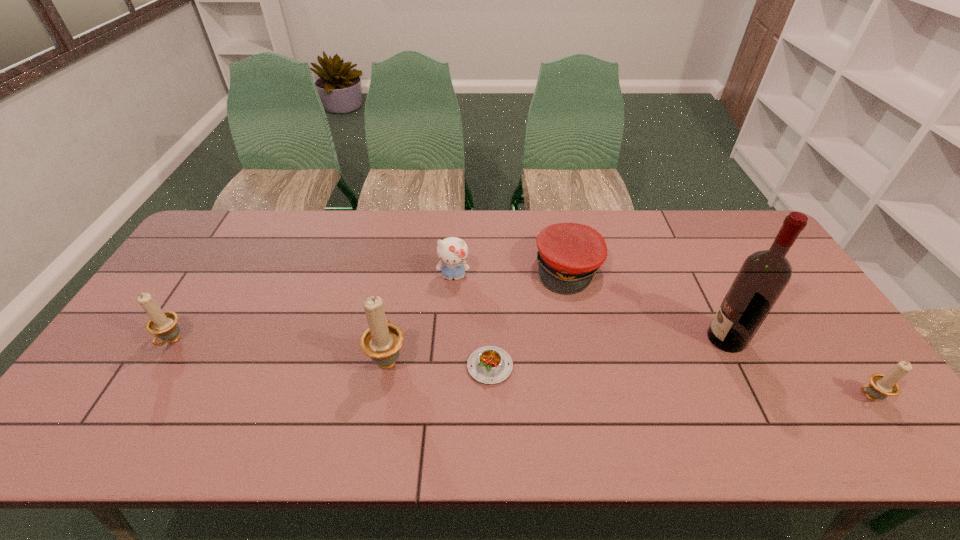
Where is `free spot between the sixth tallest object and the alcohol`? free spot between the sixth tallest object and the alcohol is located at coordinates (647, 303).

Locate an element on the screen. empty location between the alcohol and the cap is located at coordinates (647, 303).

The image size is (960, 540). What are the coordinates of `object that ranks as the second closest to the second tallest candle_holder` in the screenshot? It's located at (452, 251).

Identify which object is the second nearest to the tallest candle_holder. Please provide its 2D coordinates. Your answer should be formatted as a tuple, i.e. [(x, y)], where the tuple contains the x and y coordinates of a point satisfying the conditions above.

[(452, 251)]

Where is `candle_holder that stands as the second closest to the second candle_holder from right to left`? candle_holder that stands as the second closest to the second candle_holder from right to left is located at coordinates (881, 386).

Where is `the closest candle_holder to the leftmost candle_holder`? Image resolution: width=960 pixels, height=540 pixels. the closest candle_holder to the leftmost candle_holder is located at coordinates (382, 340).

Locate an element on the screen. The width and height of the screenshot is (960, 540). free space that satisfies the following two spatial constraints: 1. on the handle side of the shortest object; 2. on the left side of the second tallest candle_holder is located at coordinates (157, 366).

Identify the location of free region that satisfies the following two spatial constraints: 1. on the front-facing side of the pudding; 2. on the left side of the kitten. The height and width of the screenshot is (540, 960). (447, 366).